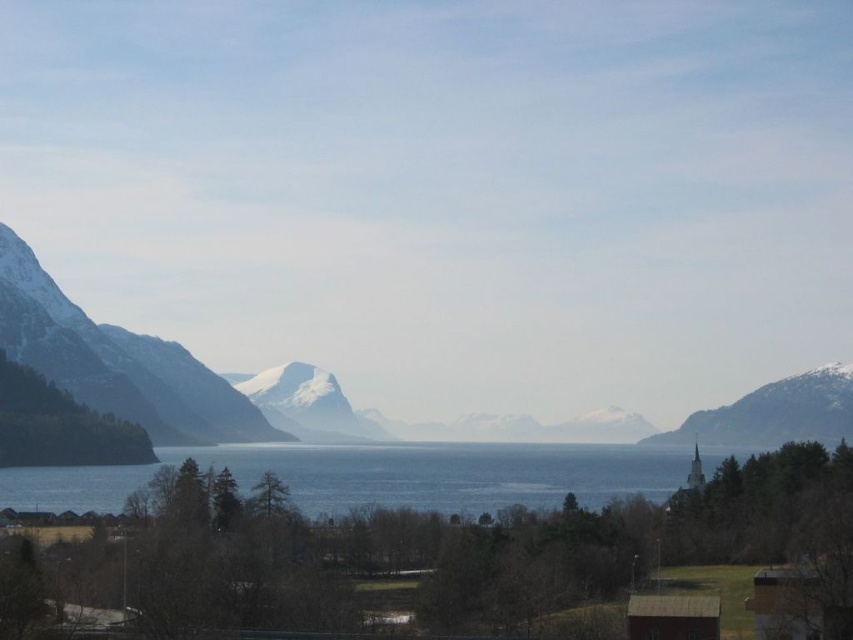
Question: Which object is farther from the camera taking this photo?

Choices:
 (A) blue water at center
 (B) snowy rock mountain at left
 (C) snowy rock mountain at right

Answer: (C)

Question: Does snowy rock mountain at left have a lesser width compared to snowy rock mountain at right?

Choices:
 (A) yes
 (B) no

Answer: (B)

Question: Which object appears farthest from the camera in this image?

Choices:
 (A) snowy rock mountain at right
 (B) blue water at center
 (C) snowy rock mountain at left

Answer: (A)

Question: Does blue water at center have a greater width compared to snowy rock mountain at left?

Choices:
 (A) yes
 (B) no

Answer: (A)

Question: Is blue water at center to the right of snowy rock mountain at right from the viewer's perspective?

Choices:
 (A) no
 (B) yes

Answer: (A)

Question: Which is nearer to the snowy rock mountain at right?

Choices:
 (A) blue water at center
 (B) snowy rock mountain at left

Answer: (A)